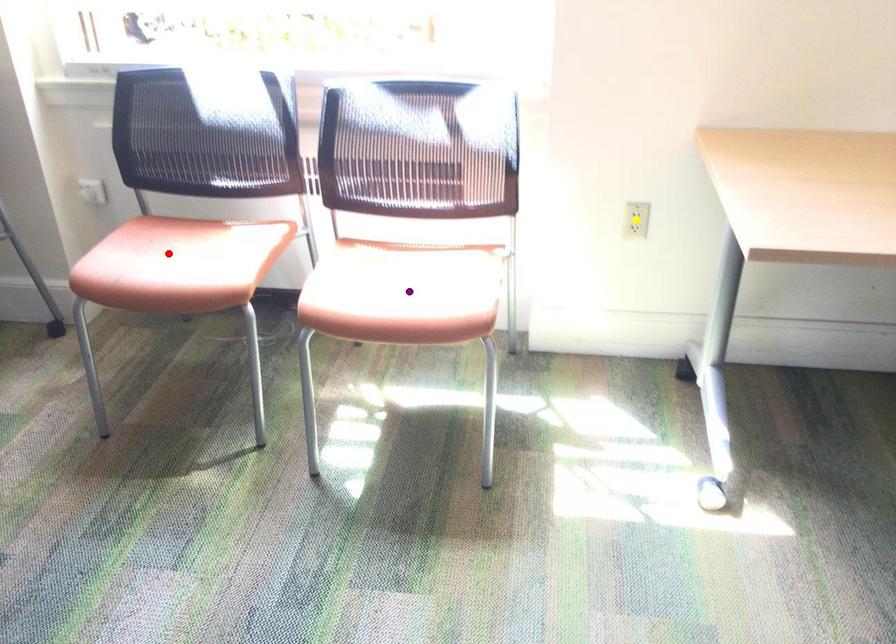
Order these from farthest to nearest:
1. red point
2. yellow point
3. purple point

1. yellow point
2. red point
3. purple point